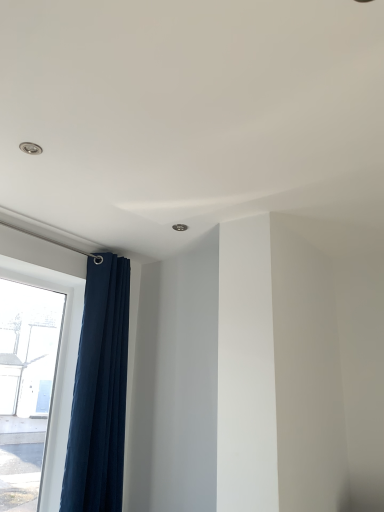
Question: Is dark blue fabric curtain at left aimed at transparent glass window at left?

Choices:
 (A) yes
 (B) no

Answer: (B)

Question: Is dark blue fabric curtain at left positioned with its back to transparent glass window at left?

Choices:
 (A) no
 (B) yes

Answer: (B)

Question: From the image's perspective, is dark blue fabric curtain at left on top of transparent glass window at left?

Choices:
 (A) no
 (B) yes

Answer: (B)

Question: Can you confirm if dark blue fabric curtain at left is shorter than transparent glass window at left?

Choices:
 (A) no
 (B) yes

Answer: (A)

Question: Considering the relative sizes of dark blue fabric curtain at left and transparent glass window at left in the image provided, is dark blue fabric curtain at left smaller than transparent glass window at left?

Choices:
 (A) yes
 (B) no

Answer: (B)

Question: Is dark blue fabric curtain at left located outside transparent glass window at left?

Choices:
 (A) yes
 (B) no

Answer: (A)

Question: Does transparent glass window at left appear on the right side of dark blue fabric curtain at left?

Choices:
 (A) yes
 (B) no

Answer: (B)

Question: Can you confirm if transparent glass window at left is taller than dark blue fabric curtain at left?

Choices:
 (A) no
 (B) yes

Answer: (A)

Question: Could you tell me if transparent glass window at left is turned towards dark blue fabric curtain at left?

Choices:
 (A) yes
 (B) no

Answer: (A)

Question: Is transparent glass window at left facing away from dark blue fabric curtain at left?

Choices:
 (A) yes
 (B) no

Answer: (B)

Question: Does transparent glass window at left appear on the left side of dark blue fabric curtain at left?

Choices:
 (A) no
 (B) yes

Answer: (B)

Question: Is transparent glass window at left located outside dark blue fabric curtain at left?

Choices:
 (A) yes
 (B) no

Answer: (A)

Question: In terms of height, does dark blue fabric curtain at left look taller or shorter compared to transparent glass window at left?

Choices:
 (A) short
 (B) tall

Answer: (B)